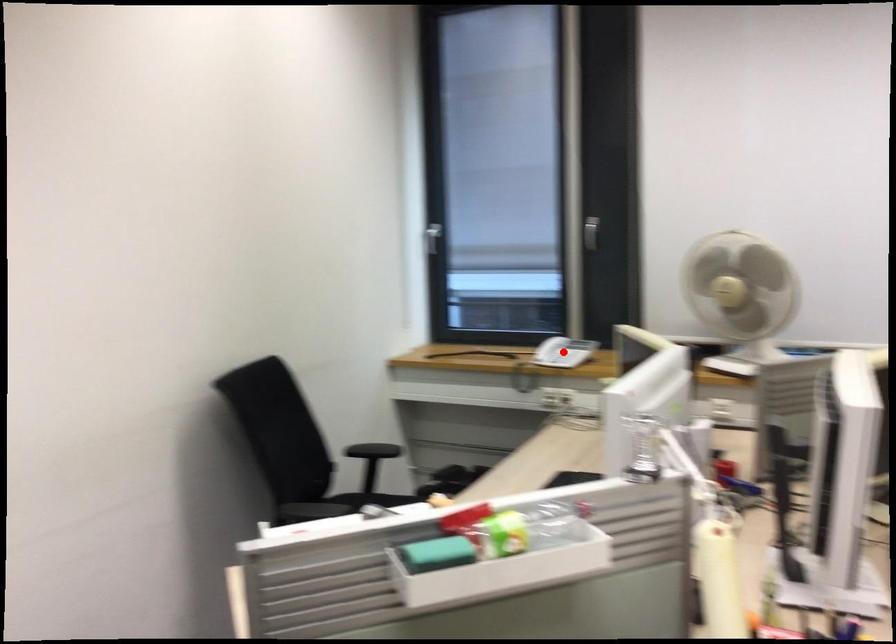
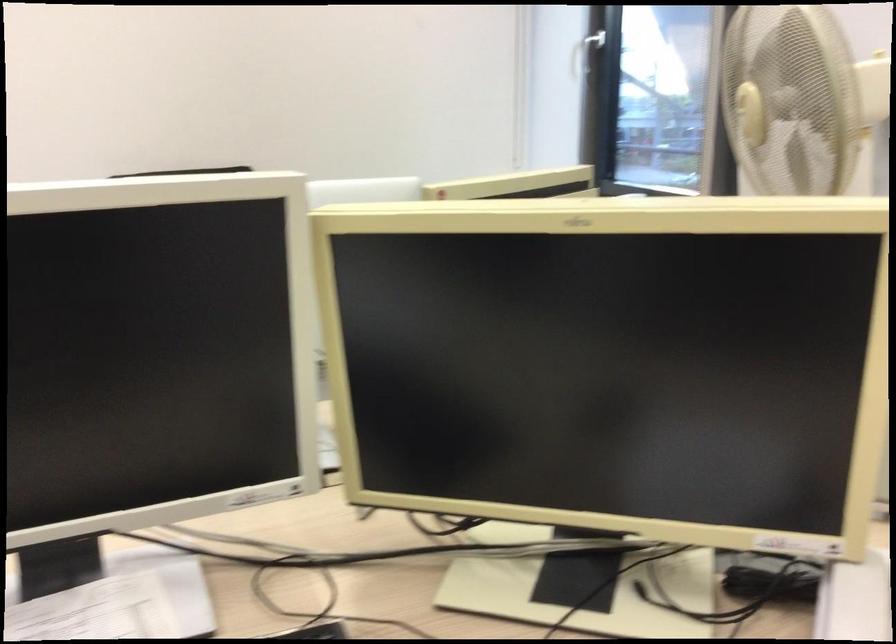
Question: I am providing you with two images of the same scene from different viewpoints. A red point is marked on the first image. At the location where the point appears in image 1, is it still visible in image 2?

Choices:
 (A) Yes
 (B) No

Answer: (B)